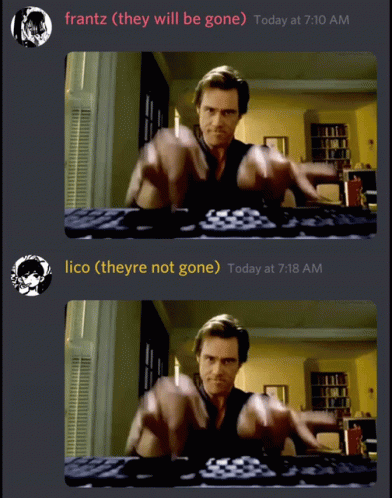
At what (x,y) coordinates should I click in order to perform the action: click on keyboard. Please return your answer as a coordinate pair (x, y). Looking at the image, I should click on tap(215, 473).